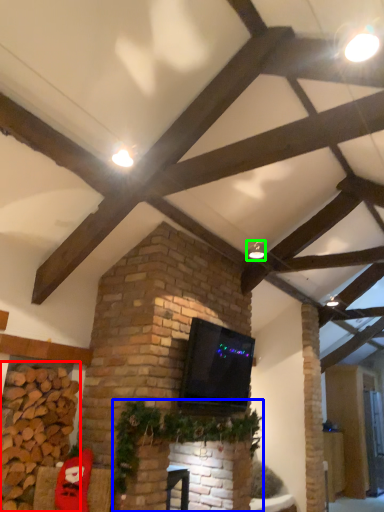
Question: Based on their relative distances, which object is nearer to brickwork (highlighted by a red box)? Choose from christmas decoration (highlighted by a blue box) and light fixture (highlighted by a green box).

Choices:
 (A) christmas decoration
 (B) light fixture

Answer: (A)